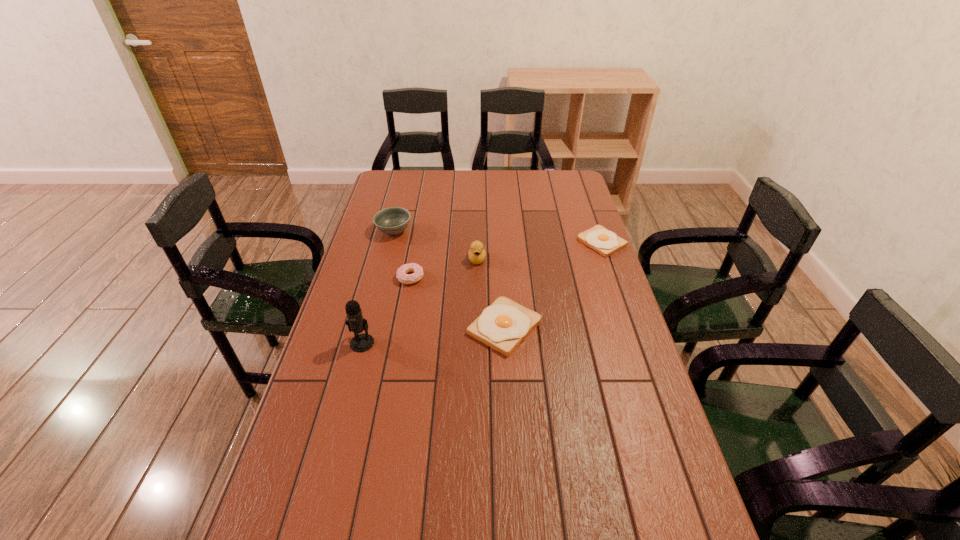
The width and height of the screenshot is (960, 540). What are the coordinates of `the left toast` in the screenshot? It's located at (503, 325).

In order to click on the nearer toast in this screenshot , I will do `click(503, 325)`.

Where is `the right toast`? The height and width of the screenshot is (540, 960). the right toast is located at coordinates (605, 242).

Where is `the farther toast`? the farther toast is located at coordinates (605, 242).

In order to click on the third nearest object in this screenshot , I will do `click(402, 276)`.

Find the location of a particular element. Image resolution: width=960 pixels, height=540 pixels. the second tallest object is located at coordinates (477, 253).

This screenshot has width=960, height=540. I want to click on bowl, so click(x=393, y=220).

I want to click on microphone, so click(x=356, y=323).

The width and height of the screenshot is (960, 540). I want to click on free spot located on the front of the taller toast, so click(511, 434).

Identify the location of free space located on the left of the rightmost object. The height and width of the screenshot is (540, 960). click(x=536, y=242).